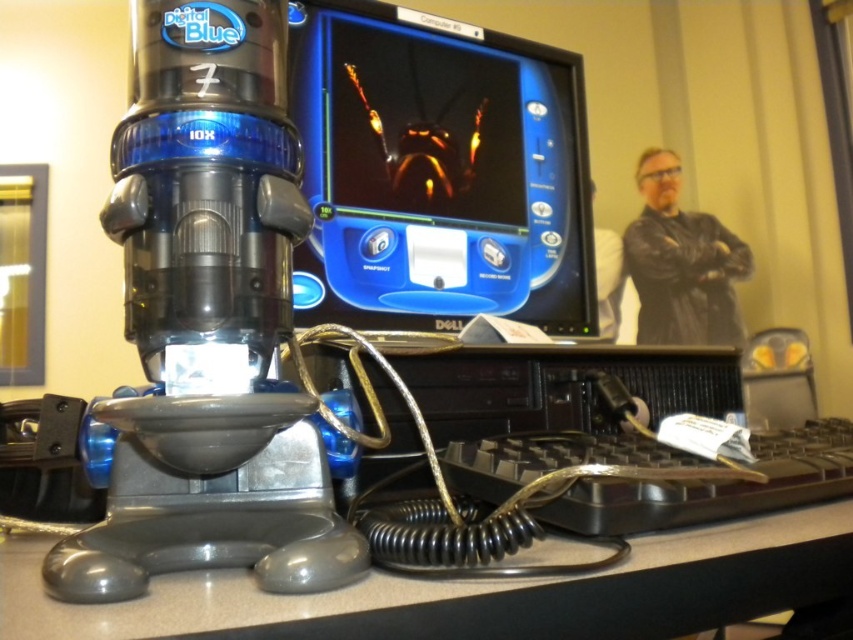
Question: Which object is positioned farthest from the metallic gray microscope at center?

Choices:
 (A) black plastic keyboard at lower right
 (B) matte black monitor at center
 (C) gray plastic table at lower center

Answer: (B)

Question: Where is metallic gray microscope at center located in relation to black plastic keyboard at lower right in the image?

Choices:
 (A) right
 (B) left

Answer: (B)

Question: Is matte black monitor at center to the right of black plastic keyboard at lower right from the viewer's perspective?

Choices:
 (A) no
 (B) yes

Answer: (A)

Question: Which object is closer to the camera taking this photo?

Choices:
 (A) black plastic keyboard at lower right
 (B) black leather jacket at upper right
 (C) metallic gray microscope at center
 (D) gray plastic table at lower center

Answer: (D)

Question: Which point is closer to the camera taking this photo?

Choices:
 (A) (680, 236)
 (B) (770, 609)
 (C) (262, 227)
 (D) (491, 260)

Answer: (C)

Question: Does gray plastic table at lower center have a lesser width compared to black plastic keyboard at lower right?

Choices:
 (A) yes
 (B) no

Answer: (B)